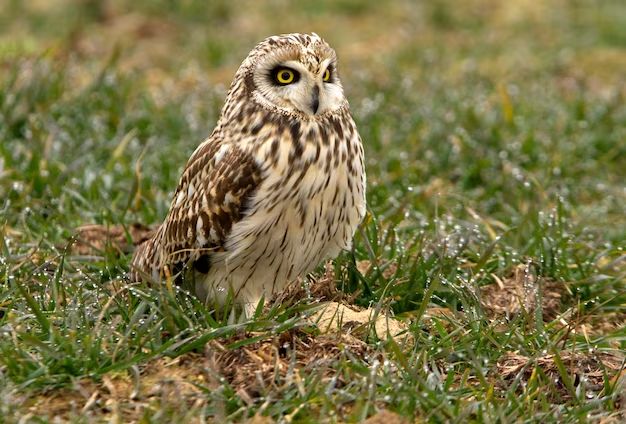
Locate an element on the screen. white fur is located at coordinates (300, 179), (331, 183), (310, 230), (262, 263).